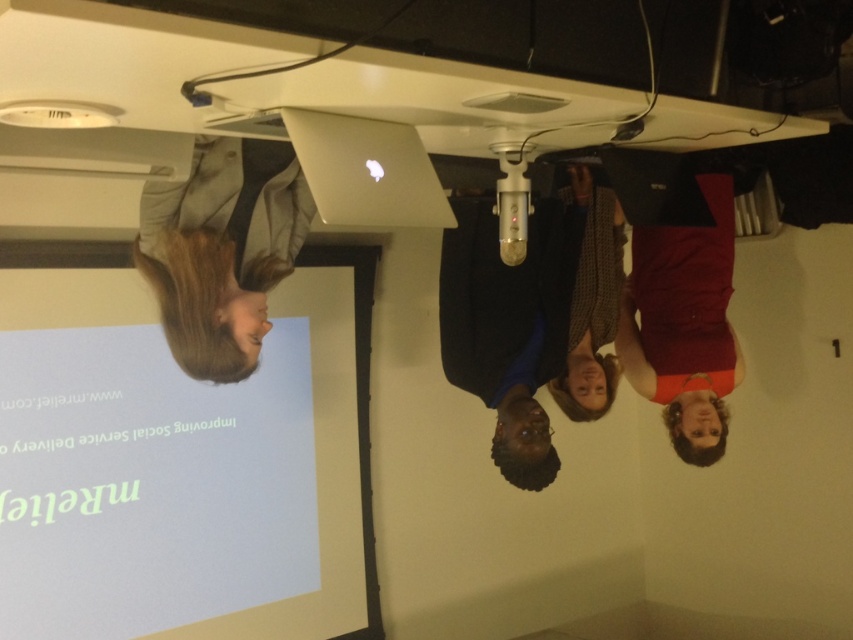
Question: Which object appears closest to the camera in this image?

Choices:
 (A) dark blue shirt at center
 (B) matte red dress at right
 (C) silver metallic laptop at upper center

Answer: (C)

Question: Does dark blue shirt at center have a smaller size compared to matte red dress at right?

Choices:
 (A) no
 (B) yes

Answer: (B)

Question: Estimate the real-world distances between objects in this image. Which object is farther from the dark blue shirt at center?

Choices:
 (A) silver metallic laptop at upper center
 (B) light brown leather jacket at upper left
 (C) matte red dress at right

Answer: (A)

Question: Which point is closer to the camera?

Choices:
 (A) (241, 515)
 (B) (689, 294)
 (C) (408, 188)

Answer: (C)

Question: Can you confirm if white matte projection screen at lower left is smaller than silver metallic laptop at upper center?

Choices:
 (A) no
 (B) yes

Answer: (A)

Question: Is matte red dress at right in front of silver metallic laptop at upper center?

Choices:
 (A) no
 (B) yes

Answer: (A)